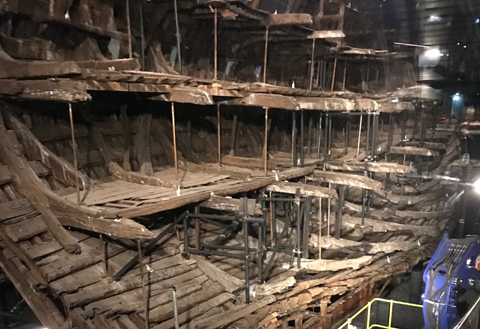
The height and width of the screenshot is (329, 480). What are the coordinates of `door ways` in the screenshot? It's located at (454, 99).